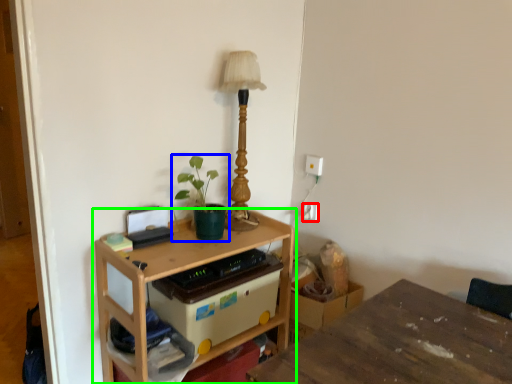
Question: Based on their relative distances, which object is nearer to electric outlet (highlighted by a red box)? Choose from houseplant (highlighted by a blue box) and table (highlighted by a green box).

Choices:
 (A) houseplant
 (B) table

Answer: (A)